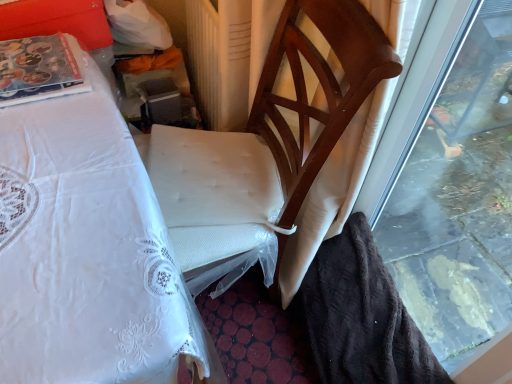
Question: Should I look upward or downward to see beige textured radiator at center?

Choices:
 (A) up
 (B) down

Answer: (A)

Question: From a real-world perspective, is beige textured radiator at center positioned over transparent glass window at right based on gravity?

Choices:
 (A) no
 (B) yes

Answer: (A)

Question: Is beige textured radiator at center not near transparent glass window at right?

Choices:
 (A) yes
 (B) no

Answer: (B)

Question: Is beige textured radiator at center facing towards transparent glass window at right?

Choices:
 (A) yes
 (B) no

Answer: (B)

Question: Can you confirm if beige textured radiator at center is wider than transparent glass window at right?

Choices:
 (A) yes
 (B) no

Answer: (A)

Question: Does beige textured radiator at center lie behind transparent glass window at right?

Choices:
 (A) yes
 (B) no

Answer: (A)

Question: Does beige textured radiator at center touch transparent glass window at right?

Choices:
 (A) yes
 (B) no

Answer: (B)

Question: Is transparent glass window at right wider than beige textured radiator at center?

Choices:
 (A) yes
 (B) no

Answer: (B)

Question: Does transparent glass window at right have a lesser height compared to beige textured radiator at center?

Choices:
 (A) no
 (B) yes

Answer: (A)

Question: Could beige textured radiator at center be considered to be inside transparent glass window at right?

Choices:
 (A) yes
 (B) no

Answer: (B)

Question: Does transparent glass window at right appear on the right side of beige textured radiator at center?

Choices:
 (A) yes
 (B) no

Answer: (A)

Question: From the image's perspective, is transparent glass window at right on top of beige textured radiator at center?

Choices:
 (A) yes
 (B) no

Answer: (B)

Question: Is transparent glass window at right to the left of beige textured radiator at center from the viewer's perspective?

Choices:
 (A) yes
 (B) no

Answer: (B)

Question: Does transparent glass window at right lie behind wooden chair at center?

Choices:
 (A) no
 (B) yes

Answer: (A)